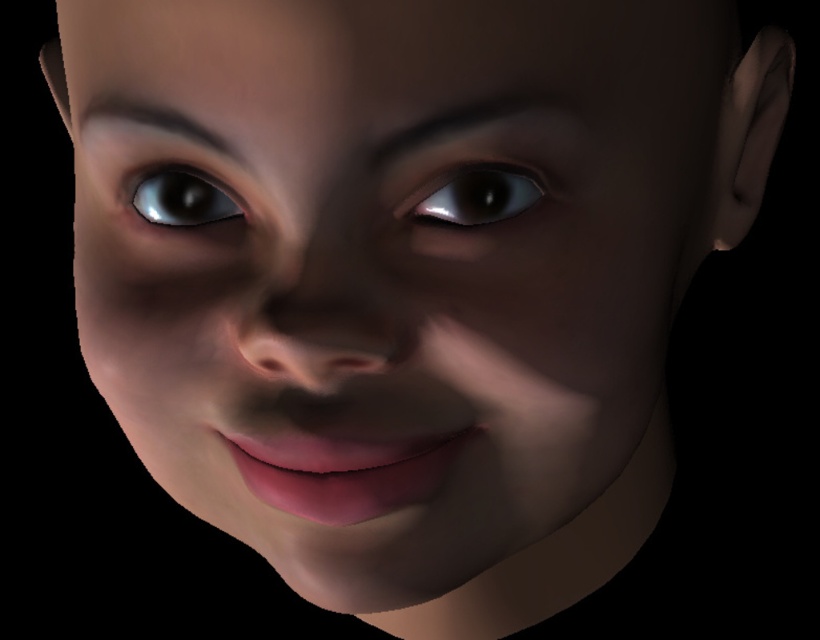
Question: Is satin silver eye at center behind shiny silver eye at center?

Choices:
 (A) yes
 (B) no

Answer: (B)

Question: Can you confirm if satin silver eye at center is positioned below shiny silver eye at center?

Choices:
 (A) yes
 (B) no

Answer: (A)

Question: Is satin silver eye at center thinner than shiny silver eye at center?

Choices:
 (A) yes
 (B) no

Answer: (B)

Question: Which of the following is the closest to the observer?

Choices:
 (A) (417, 192)
 (B) (183, 216)

Answer: (A)

Question: Which point is farther from the camera taking this photo?

Choices:
 (A) (185, 177)
 (B) (472, 221)

Answer: (A)